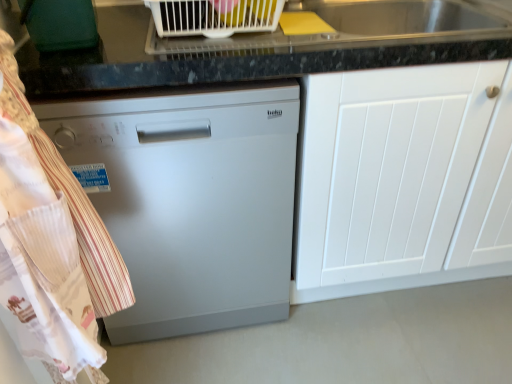
Question: Is satin silver dishwasher at center behind white matte cabinet at center?

Choices:
 (A) yes
 (B) no

Answer: (B)

Question: Is satin silver dishwasher at center oriented away from white matte cabinet at center?

Choices:
 (A) yes
 (B) no

Answer: (B)

Question: Is satin silver dishwasher at center smaller than white matte cabinet at center?

Choices:
 (A) no
 (B) yes

Answer: (B)

Question: Is satin silver dishwasher at center located outside white matte cabinet at center?

Choices:
 (A) yes
 (B) no

Answer: (A)

Question: Is satin silver dishwasher at center at the right side of white matte cabinet at center?

Choices:
 (A) no
 (B) yes

Answer: (A)

Question: Is satin silver dishwasher at center directly adjacent to white matte cabinet at center?

Choices:
 (A) no
 (B) yes

Answer: (A)

Question: Does white matte cabinet at center have a lesser width compared to satin silver dishwasher at center?

Choices:
 (A) no
 (B) yes

Answer: (A)

Question: Is satin silver dishwasher at center a part of white matte cabinet at center?

Choices:
 (A) yes
 (B) no

Answer: (B)

Question: Is white matte cabinet at center smaller than satin silver dishwasher at center?

Choices:
 (A) no
 (B) yes

Answer: (A)

Question: Considering the relative sizes of white matte cabinet at center and satin silver dishwasher at center in the image provided, is white matte cabinet at center bigger than satin silver dishwasher at center?

Choices:
 (A) no
 (B) yes

Answer: (B)

Question: From a real-world perspective, is white matte cabinet at center positioned under satin silver dishwasher at center based on gravity?

Choices:
 (A) yes
 (B) no

Answer: (A)

Question: Considering the relative positions of white matte cabinet at center and satin silver dishwasher at center in the image provided, is white matte cabinet at center to the right of satin silver dishwasher at center from the viewer's perspective?

Choices:
 (A) yes
 (B) no

Answer: (A)

Question: Does white striped fabric at left have a greater width compared to satin silver dishwasher at center?

Choices:
 (A) yes
 (B) no

Answer: (B)